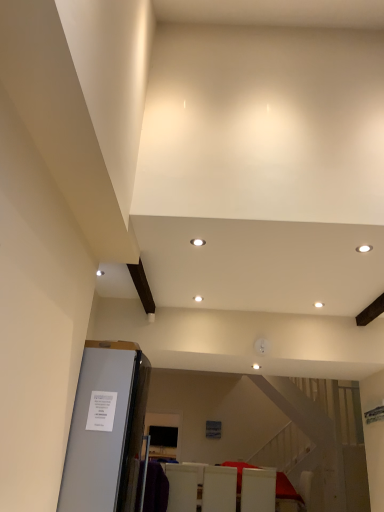
Question: Is satin silver refrigerator at lower left not within white glossy chair at lower center, acting as the third furniture starting from the left?

Choices:
 (A) yes
 (B) no

Answer: (A)

Question: Is satin silver refrigerator at lower left shorter than white glossy chair at lower center, the first furniture positioned from the right?

Choices:
 (A) yes
 (B) no

Answer: (B)

Question: Are satin silver refrigerator at lower left and white glossy chair at lower center, acting as the third furniture starting from the left, beside each other?

Choices:
 (A) yes
 (B) no

Answer: (B)

Question: Considering the relative sizes of satin silver refrigerator at lower left and white glossy chair at lower center, acting as the third furniture starting from the left, in the image provided, is satin silver refrigerator at lower left smaller than white glossy chair at lower center, acting as the third furniture starting from the left,?

Choices:
 (A) no
 (B) yes

Answer: (A)

Question: From a real-world perspective, is satin silver refrigerator at lower left over white glossy chair at lower center, acting as the third furniture starting from the left?

Choices:
 (A) no
 (B) yes

Answer: (B)

Question: From the image's perspective, is white glossy chair at lower center, acting as the third furniture starting from the left, above or below white matte chair at lower center, the 3th furniture in the right-to-left sequence?

Choices:
 (A) below
 (B) above

Answer: (A)

Question: Looking at the image, does white glossy chair at lower center, the first furniture positioned from the right, seem bigger or smaller compared to white matte chair at lower center, which appears as the first furniture when viewed from the left?

Choices:
 (A) big
 (B) small

Answer: (B)

Question: From a real-world perspective, relative to white matte chair at lower center, the 3th furniture in the right-to-left sequence, is white glossy chair at lower center, acting as the third furniture starting from the left, vertically above or below?

Choices:
 (A) below
 (B) above

Answer: (B)

Question: Is point (268, 487) closer or farther from the camera than point (185, 489)?

Choices:
 (A) closer
 (B) farther

Answer: (A)

Question: From the image's perspective, is satin silver refrigerator at lower left located above or below white glossy chair at lower center, the first furniture positioned from the right?

Choices:
 (A) below
 (B) above

Answer: (B)

Question: Visually, is satin silver refrigerator at lower left positioned to the left or to the right of white glossy chair at lower center, acting as the third furniture starting from the left?

Choices:
 (A) right
 (B) left

Answer: (B)

Question: From a real-world perspective, is satin silver refrigerator at lower left physically located above or below white glossy chair at lower center, acting as the third furniture starting from the left?

Choices:
 (A) below
 (B) above

Answer: (B)

Question: Is satin silver refrigerator at lower left situated inside white glossy chair at lower center, acting as the third furniture starting from the left, or outside?

Choices:
 (A) inside
 (B) outside

Answer: (B)

Question: Based on their positions, is white glossy chair at lower center, acting as the third furniture starting from the left, located to the left or right of satin silver refrigerator at lower left?

Choices:
 (A) left
 (B) right

Answer: (B)

Question: Is point (246, 489) closer or farther from the camera than point (94, 357)?

Choices:
 (A) closer
 (B) farther

Answer: (B)